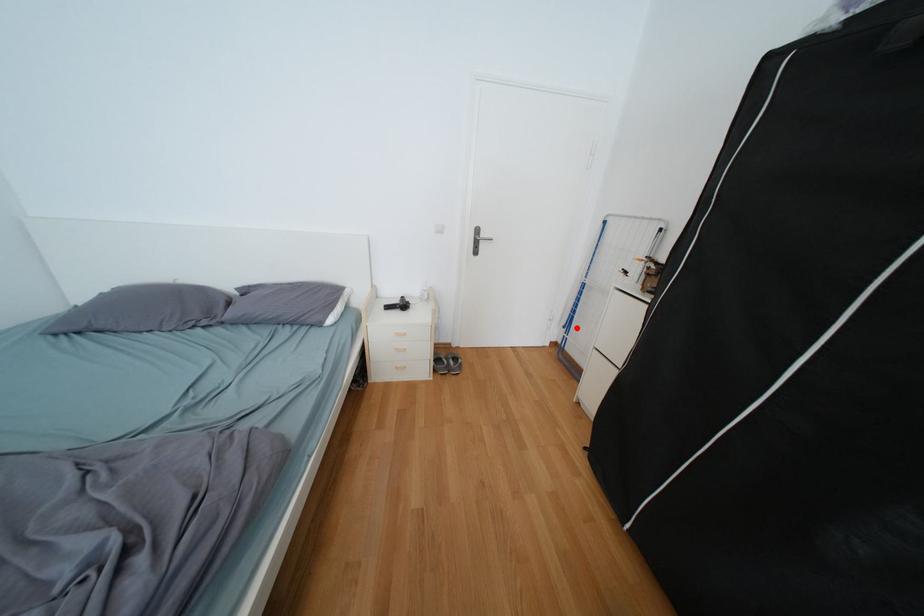
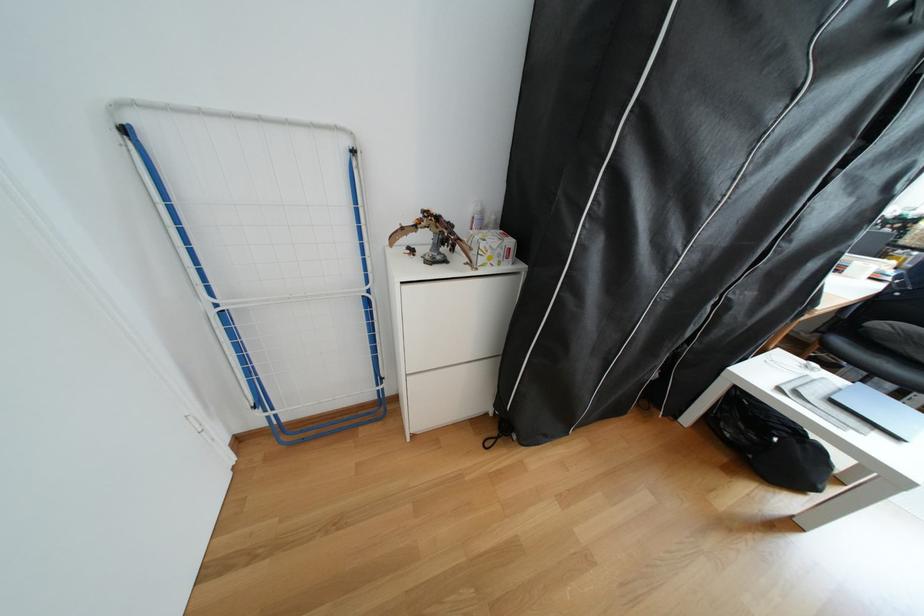
In the second image, find the point that corresponds to the highlighted location in the first image.

(266, 408)